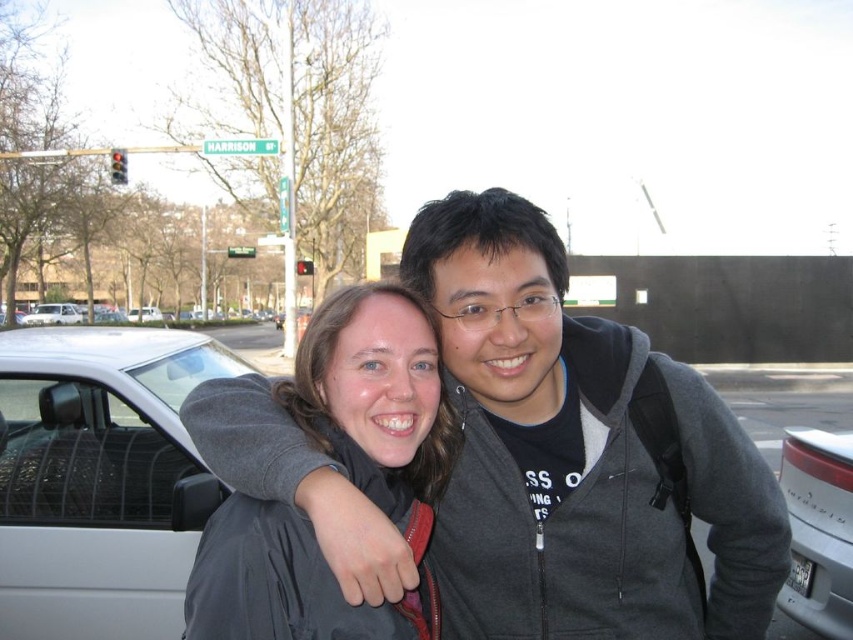
From the picture: You are a delivery driver who needs to park your vehicle between the silver metallic car at lower right and the silver metallic sedan at left. Your delivery van is 6 meters long. Is there enough space between them to park your van?

The distance between the silver metallic car at lower right and the silver metallic sedan at left is 43.15 meters, so yes, there is enough space to park a 6 meter long van between them.